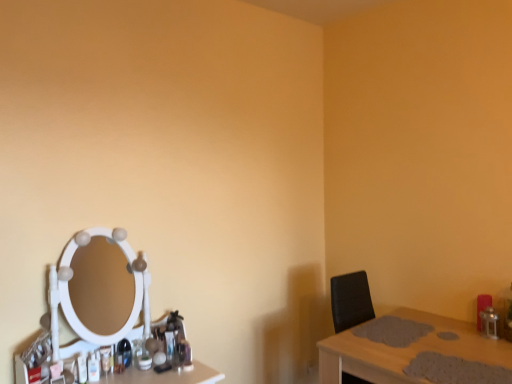
Question: From a real-world perspective, is wooden table at right above or below white glossy makeup mirror at left?

Choices:
 (A) below
 (B) above

Answer: (A)

Question: In terms of width, does wooden table at right look wider or thinner when compared to white glossy makeup mirror at left?

Choices:
 (A) thin
 (B) wide

Answer: (B)

Question: From the image's perspective, is wooden table at right above or below white glossy makeup mirror at left?

Choices:
 (A) above
 (B) below

Answer: (B)

Question: Would you say white glossy makeup mirror at left is inside or outside wooden table at right?

Choices:
 (A) inside
 (B) outside

Answer: (B)

Question: From the image's perspective, is white glossy makeup mirror at left positioned above or below wooden table at right?

Choices:
 (A) below
 (B) above

Answer: (B)

Question: Is white glossy makeup mirror at left bigger or smaller than wooden table at right?

Choices:
 (A) big
 (B) small

Answer: (B)

Question: Is white glossy makeup mirror at left in front of or behind wooden table at right in the image?

Choices:
 (A) front
 (B) behind

Answer: (B)